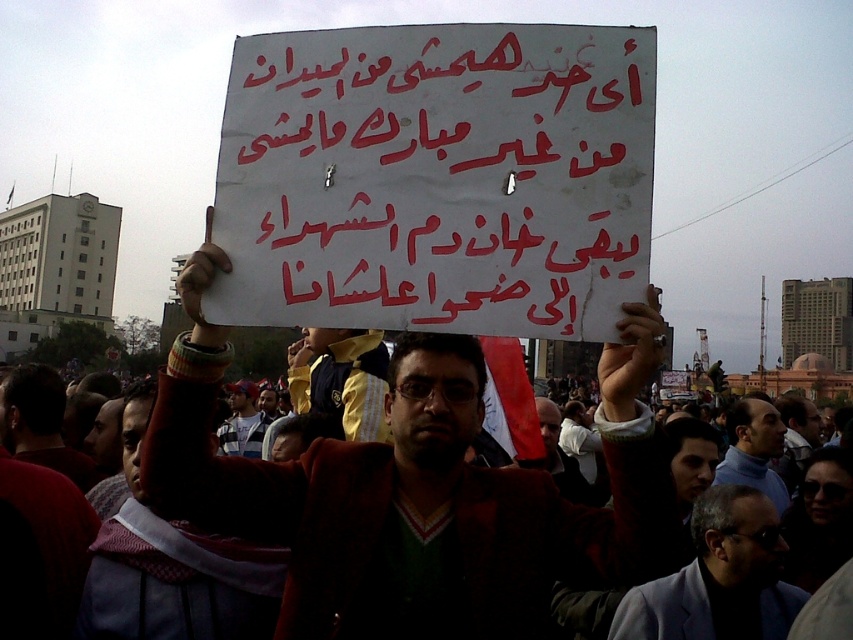
Looking at this image, is dark brown jacket at center to the right of blue turtleneck sweater at center from the viewer's perspective?

Incorrect, dark brown jacket at center is not on the right side of blue turtleneck sweater at center.

Can you confirm if dark brown jacket at center is bigger than blue turtleneck sweater at center?

Yes, dark brown jacket at center is bigger than blue turtleneck sweater at center.

Between point (351, 531) and point (738, 451), which one is positioned behind?

Positioned behind is point (738, 451).

Where is `dark brown jacket at center`? Image resolution: width=853 pixels, height=640 pixels. dark brown jacket at center is located at coordinates (416, 492).

Can you confirm if white paper placard at center is positioned to the left of blue turtleneck sweater at center?

Yes, white paper placard at center is to the left of blue turtleneck sweater at center.

Can you confirm if white paper placard at center is positioned to the right of blue turtleneck sweater at center?

In fact, white paper placard at center is to the left of blue turtleneck sweater at center.

Identify the location of white paper placard at center. This screenshot has width=853, height=640. (437, 179).

Who is positioned more to the right, white paper placard at center or dark brown jacket at center?

white paper placard at center

Who is more forward, (485, 284) or (189, 458)?

Positioned in front is point (485, 284).

The width and height of the screenshot is (853, 640). I want to click on white paper placard at center, so click(x=437, y=179).